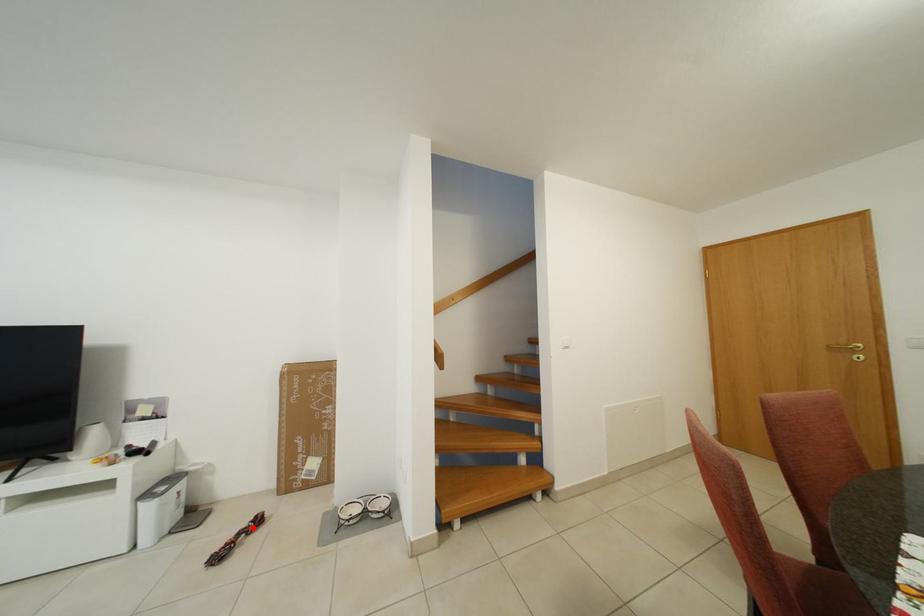
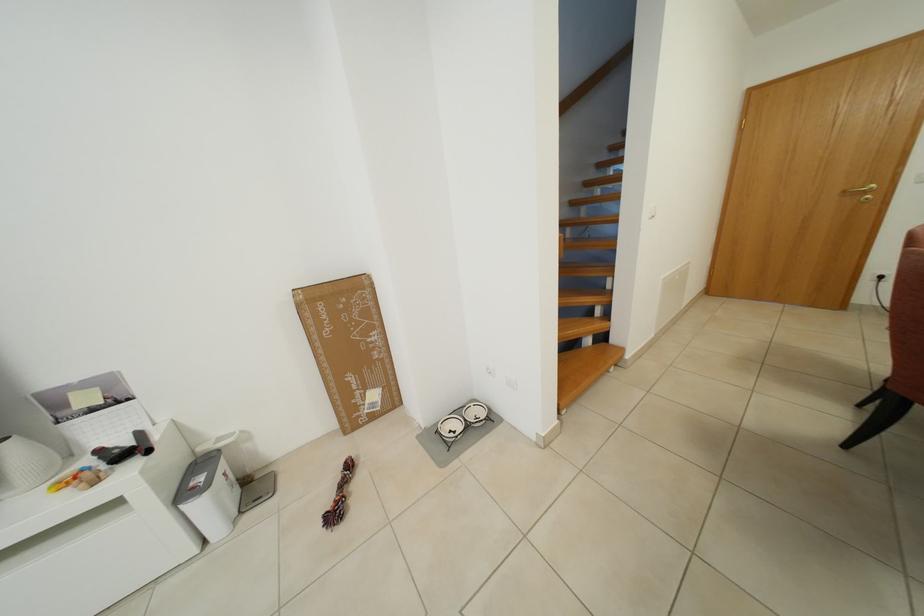
Where in the second image is the point corresponding to the highlighted location from the first image?

(346, 479)